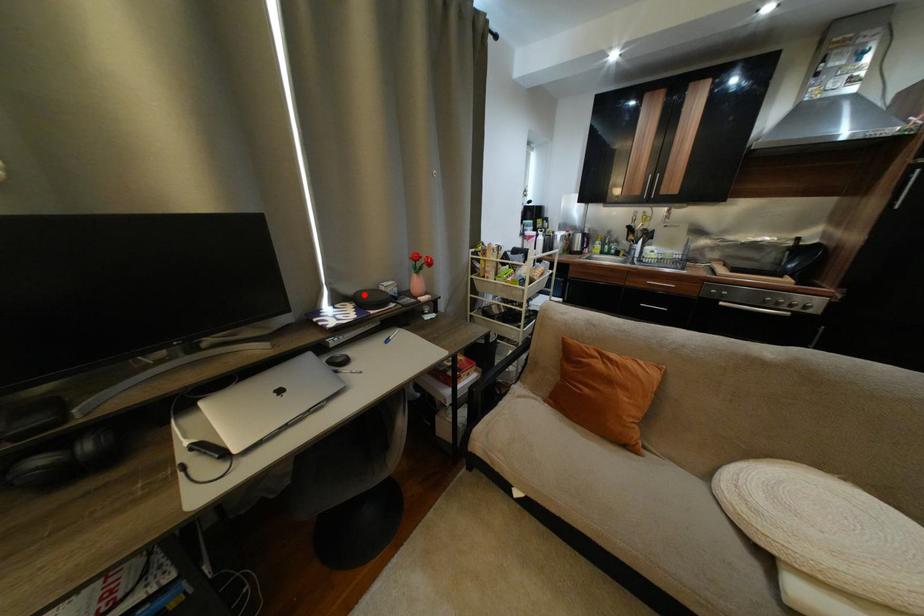
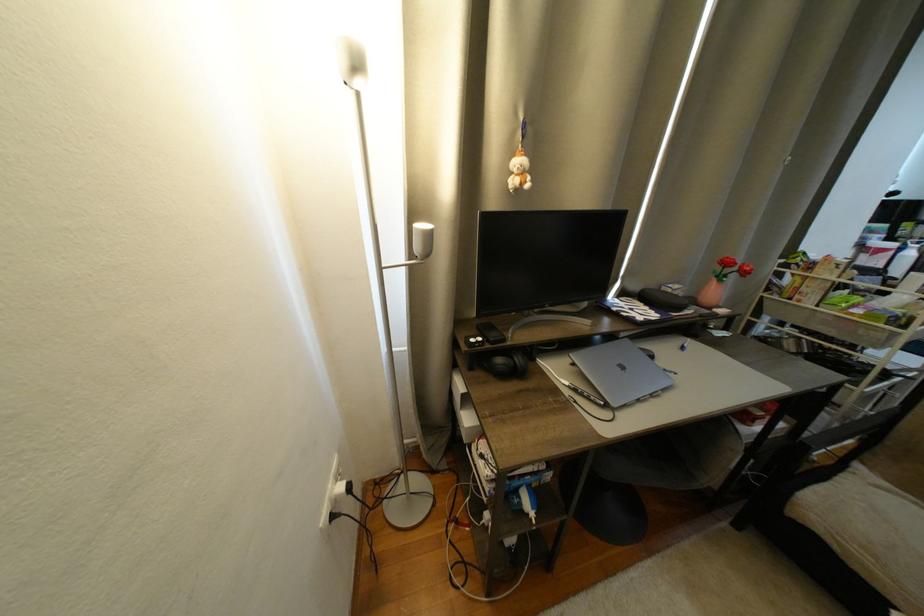
The point at the highlighted location is marked in the first image. Where is the corresponding point in the second image?

(650, 292)